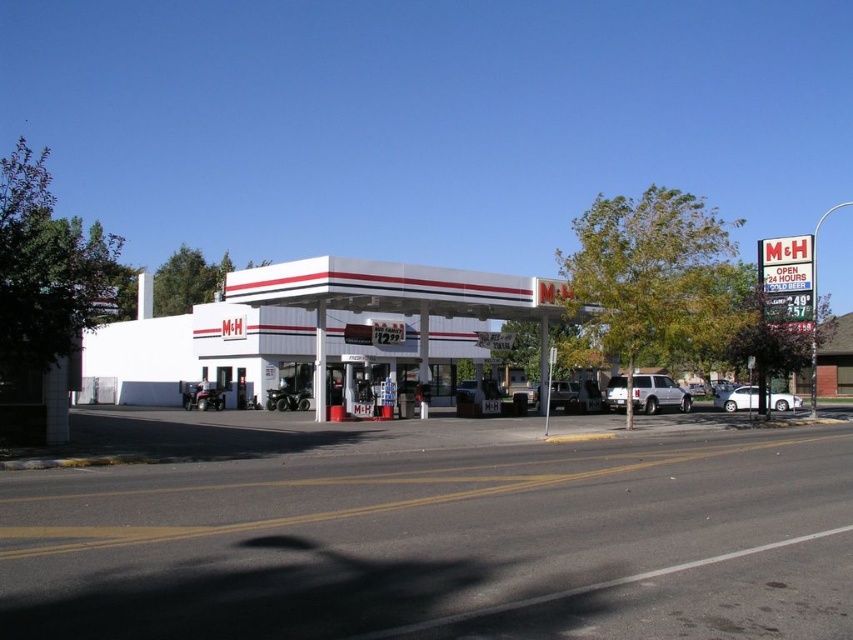
Does white matte gas station at center have a lesser width compared to white matte sedan at lower right?

In fact, white matte gas station at center might be wider than white matte sedan at lower right.

Does white matte gas station at center lie behind white matte sedan at lower right?

No, white matte gas station at center is closer to the viewer.

What do you see at coordinates (315, 326) in the screenshot? The width and height of the screenshot is (853, 640). I see `white matte gas station at center` at bounding box center [315, 326].

Where is `white matte gas station at center`? This screenshot has width=853, height=640. white matte gas station at center is located at coordinates (315, 326).

Does white matte gas station at center appear on the right side of white matte suv at center?

In fact, white matte gas station at center is to the left of white matte suv at center.

Where is `white matte gas station at center`? white matte gas station at center is located at coordinates [x=315, y=326].

You are a GUI agent. You are given a task and a screenshot of the screen. Output one action in this format:
    pyautogui.click(x=<x>, y=<y>)
    Task: Click on the white matte gas station at center
    The height and width of the screenshot is (640, 853).
    Given the screenshot: What is the action you would take?
    pyautogui.click(x=315, y=326)

Consider the image. Between white matte suv at center and white matte sedan at lower right, which one has more height?

white matte suv at center is taller.

Can you confirm if white matte suv at center is bigger than white matte sedan at lower right?

Yes.

This screenshot has width=853, height=640. I want to click on white matte suv at center, so click(x=657, y=394).

This screenshot has height=640, width=853. I want to click on white matte suv at center, so click(x=657, y=394).